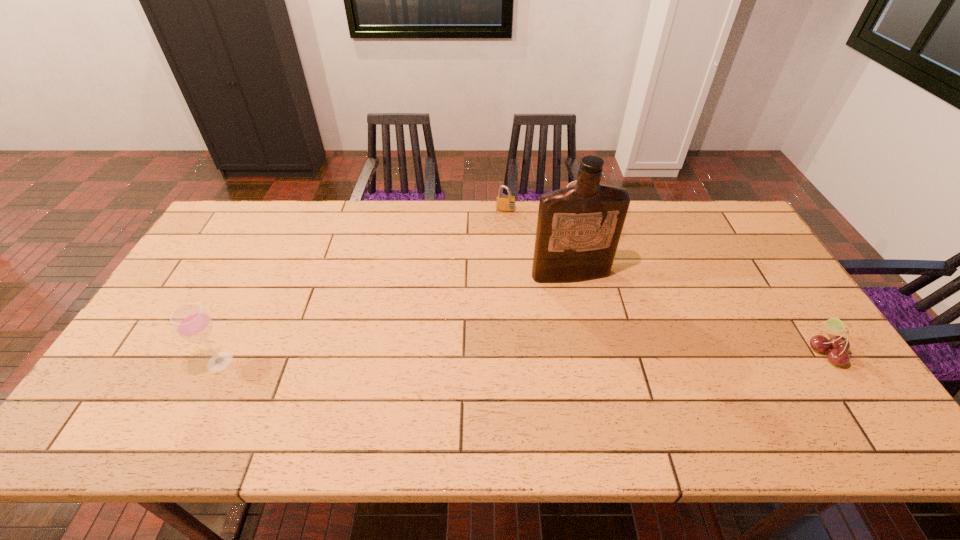
Locate an element on the screen. The width and height of the screenshot is (960, 540). padlock located at the far edge is located at coordinates (506, 203).

At what (x,y) coordinates should I click in order to perform the action: click on mug present at the far edge. Please return your answer as a coordinate pair (x, y). Image resolution: width=960 pixels, height=540 pixels. Looking at the image, I should click on (572, 183).

Locate an element on the screen. The height and width of the screenshot is (540, 960). object that is at the near edge is located at coordinates (191, 321).

The width and height of the screenshot is (960, 540). In order to click on object that is at the right edge in this screenshot , I will do `click(838, 345)`.

In the image, there is a desktop. Find the location of `vacant space at the far edge`. vacant space at the far edge is located at coordinates (681, 204).

In the image, there is a desktop. Where is `vacant space at the near edge`? The image size is (960, 540). vacant space at the near edge is located at coordinates (488, 379).

This screenshot has height=540, width=960. In the image, there is a desktop. What are the coordinates of `free region at the far left corner` in the screenshot? It's located at (229, 219).

Find the location of `vacant space at the far right corner`. vacant space at the far right corner is located at coordinates (692, 211).

This screenshot has width=960, height=540. I want to click on empty space that is in between the wineglass and the liquor, so (396, 318).

Where is `free space between the leftmost object and the second object from left to right`? This screenshot has width=960, height=540. free space between the leftmost object and the second object from left to right is located at coordinates (363, 287).